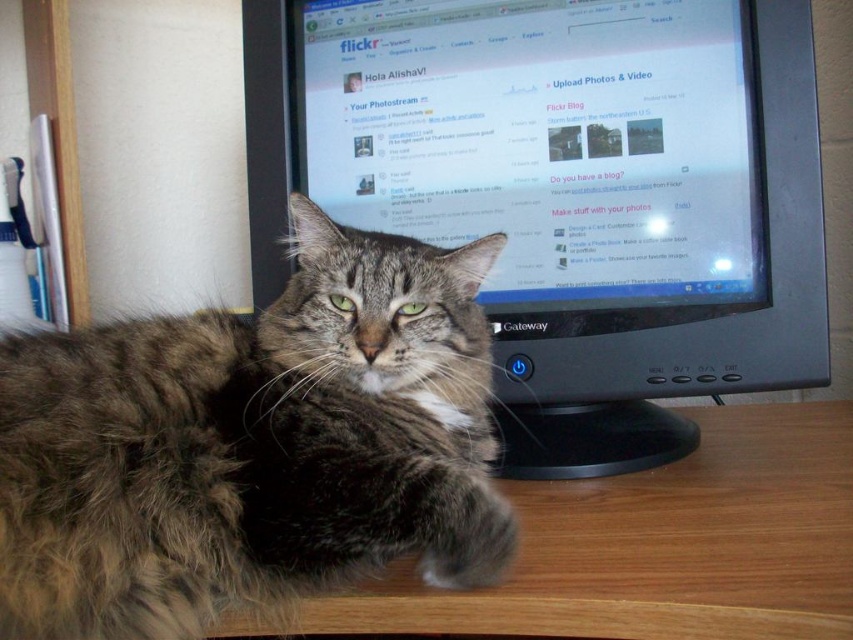
Does black plastic monitor at center appear under wooden at lower left?

No.

In the scene shown: Which is above, black plastic monitor at center or wooden at lower left?

black plastic monitor at center is above.

At what (x,y) coordinates should I click in order to perform the action: click on black plastic monitor at center. Please return your answer as a coordinate pair (x, y). This screenshot has width=853, height=640. Looking at the image, I should click on (567, 192).

Is point (370, 481) farther from camera compared to point (517, 481)?

No, (370, 481) is closer to viewer.

Locate an element on the screen. This screenshot has width=853, height=640. gray tabby cat at center is located at coordinates (252, 444).

The width and height of the screenshot is (853, 640). What are the coordinates of `gray tabby cat at center` in the screenshot? It's located at (252, 444).

Image resolution: width=853 pixels, height=640 pixels. I want to click on gray tabby cat at center, so click(x=252, y=444).

Who is higher up, black plastic monitor at center or gray tabby cat at center?

black plastic monitor at center

Does black plastic monitor at center come in front of gray tabby cat at center?

No, it is behind gray tabby cat at center.

In the scene shown: Who is more distant from viewer, (733, 378) or (148, 627)?

Point (733, 378)

The height and width of the screenshot is (640, 853). What are the coordinates of `black plastic monitor at center` in the screenshot? It's located at (567, 192).